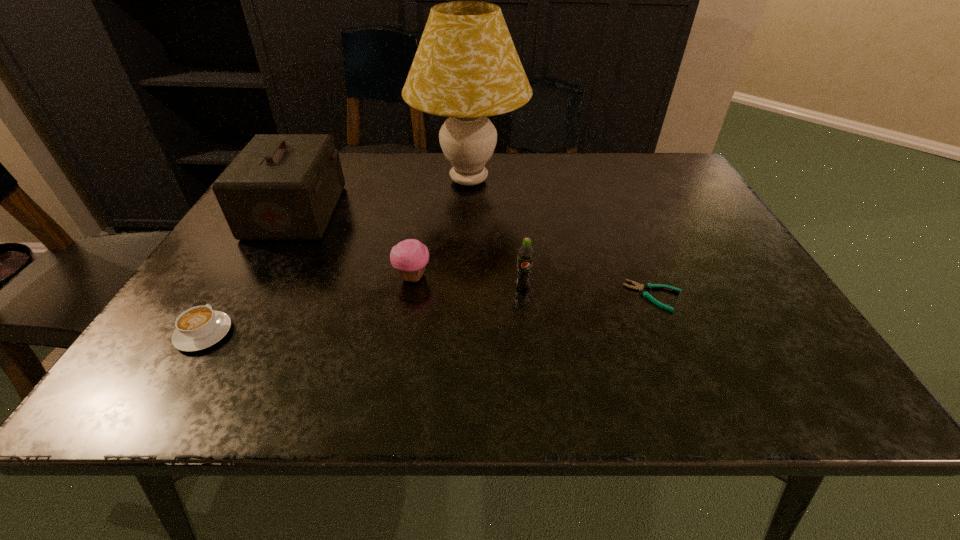
Locate an element on the screen. The width and height of the screenshot is (960, 540). lampshade is located at coordinates (466, 67).

At what (x,y) coordinates should I click in order to perform the action: click on the second tallest object. Please return your answer as a coordinate pair (x, y). This screenshot has width=960, height=540. Looking at the image, I should click on (280, 186).

Locate an element on the screen. The image size is (960, 540). the third tallest object is located at coordinates (525, 253).

Find the location of a particular element. The height and width of the screenshot is (540, 960). cupcake is located at coordinates (409, 257).

I want to click on the second shortest object, so click(x=197, y=328).

This screenshot has width=960, height=540. In order to click on cappuccino in this screenshot , I will do `click(197, 328)`.

Locate an element on the screen. This screenshot has width=960, height=540. pliers is located at coordinates (644, 293).

The image size is (960, 540). Find the location of `the rightmost object`. the rightmost object is located at coordinates (644, 293).

I want to click on blank space located 0.330m on the left of the lampshade, so click(293, 180).

Locate an element on the screen. vacant space located on the front of the fifth shortest object is located at coordinates (197, 392).